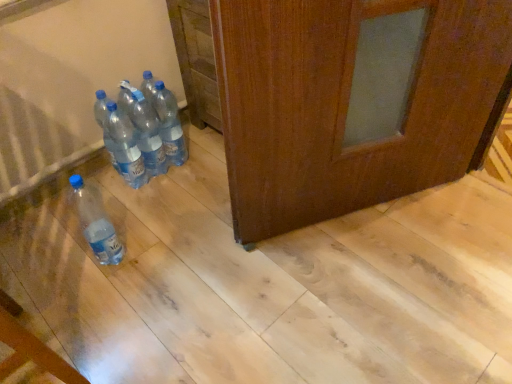
I want to click on free space on the front side of transparent plastic bottles at center, acting as the 4th bottle starting from the left, so [177, 191].